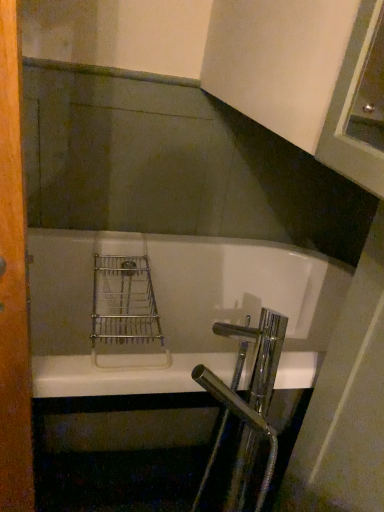
Question: From a real-world perspective, is white glossy bathtub at center on wooden screen door at left?

Choices:
 (A) yes
 (B) no

Answer: (B)

Question: Is wooden screen door at left inside white glossy bathtub at center?

Choices:
 (A) no
 (B) yes

Answer: (A)

Question: Is white glossy bathtub at center thinner than wooden screen door at left?

Choices:
 (A) yes
 (B) no

Answer: (B)

Question: Does white glossy bathtub at center have a lesser height compared to wooden screen door at left?

Choices:
 (A) yes
 (B) no

Answer: (A)

Question: Is white glossy bathtub at center behind wooden screen door at left?

Choices:
 (A) yes
 (B) no

Answer: (A)

Question: Is white glossy bathtub at center completely or partially outside of wooden screen door at left?

Choices:
 (A) no
 (B) yes

Answer: (B)

Question: Could you tell me if wooden screen door at left is turned towards white glossy bathtub at center?

Choices:
 (A) no
 (B) yes

Answer: (A)

Question: Can you confirm if wooden screen door at left is thinner than white glossy bathtub at center?

Choices:
 (A) no
 (B) yes

Answer: (B)

Question: From a real-world perspective, does wooden screen door at left stand above white glossy bathtub at center?

Choices:
 (A) yes
 (B) no

Answer: (A)

Question: From a real-world perspective, is wooden screen door at left positioned under white glossy bathtub at center based on gravity?

Choices:
 (A) yes
 (B) no

Answer: (B)

Question: Can you confirm if wooden screen door at left is shorter than white glossy bathtub at center?

Choices:
 (A) no
 (B) yes

Answer: (A)

Question: Does wooden screen door at left lie behind white glossy bathtub at center?

Choices:
 (A) no
 (B) yes

Answer: (A)

Question: In the image, is white glossy bathtub at center positioned in front of or behind wooden screen door at left?

Choices:
 (A) behind
 (B) front

Answer: (A)